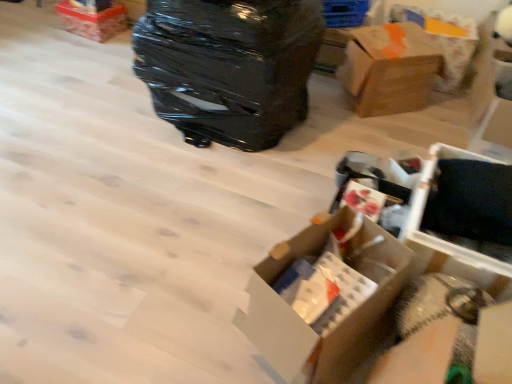
Identify the location of vacant region in front of brown cardboard box at upper right, the third box when ordered from left to right. The width and height of the screenshot is (512, 384). (374, 127).